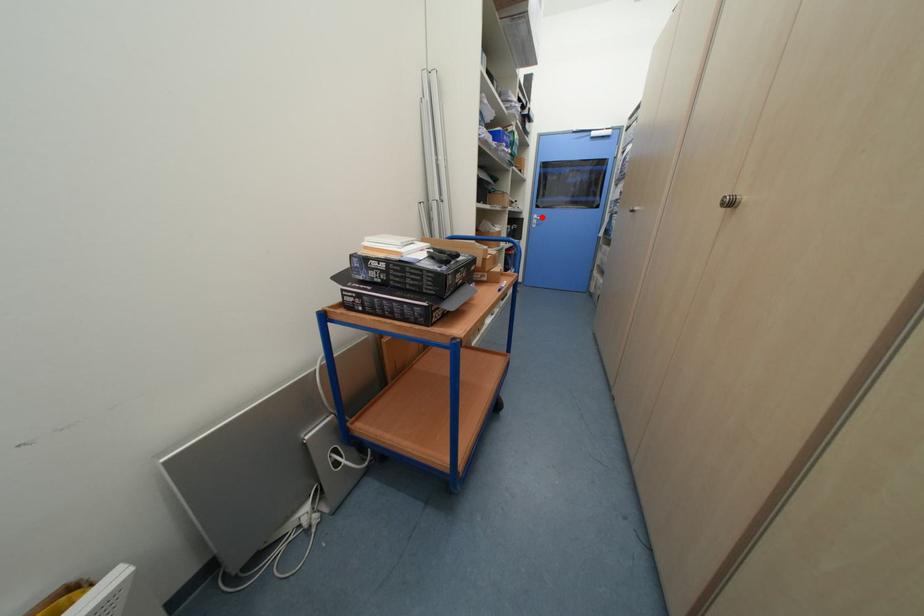
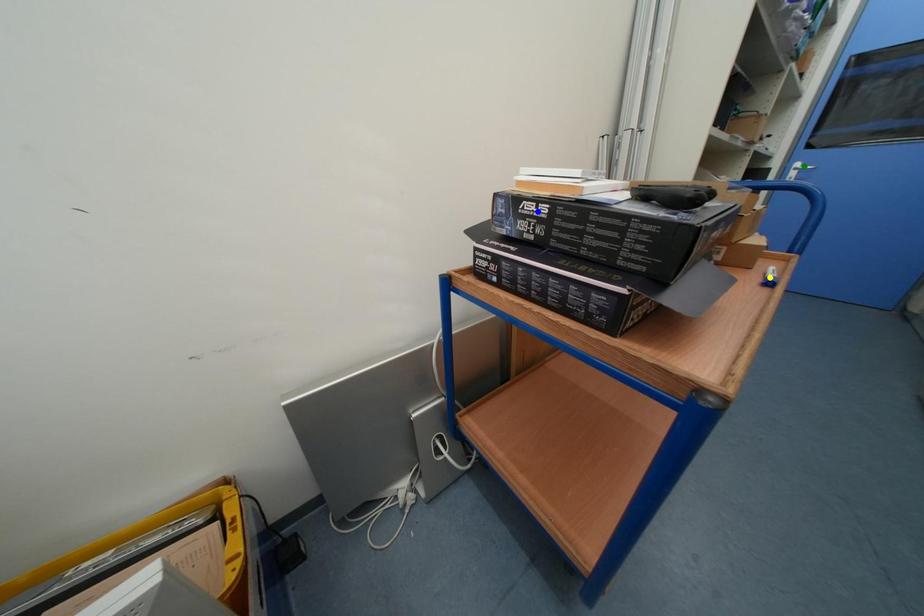
Question: I am providing you with two images of the same scene from different viewpoints. A red point is marked on the first image. You are given multiple points on the second image. Which point in image 2 is actually the same real-world point as the red point in image 1?

Choices:
 (A) yellow point
 (B) green point
 (C) blue point

Answer: (B)